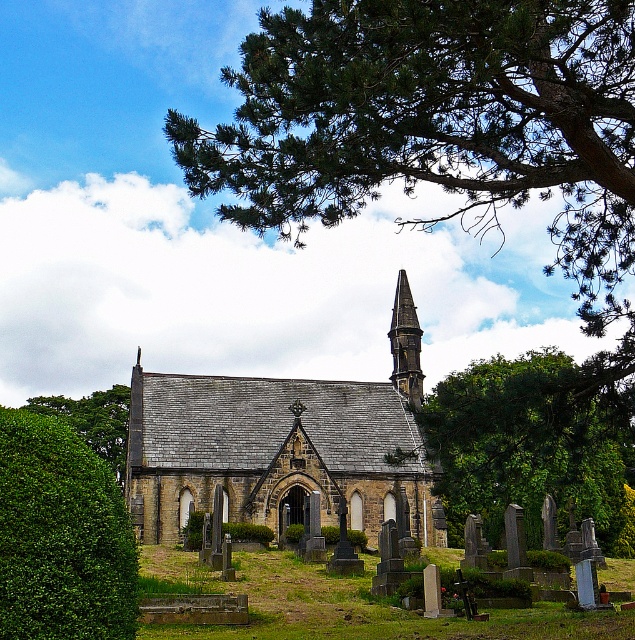
You are standing in the churchyard and want to hide behind a green leafy hedge at left or a green leafy bush at lower left. Which one would provide better concealment due to its height?

The green leafy hedge at left has a greater height compared to the green leafy bush at lower left, so it would provide better concealment.